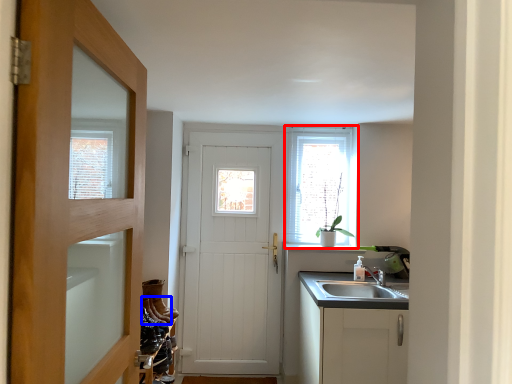
Question: Which of the following is the farthest to the observer, window (highlighted by a red box) or shoe (highlighted by a blue box)?

Choices:
 (A) window
 (B) shoe

Answer: (A)